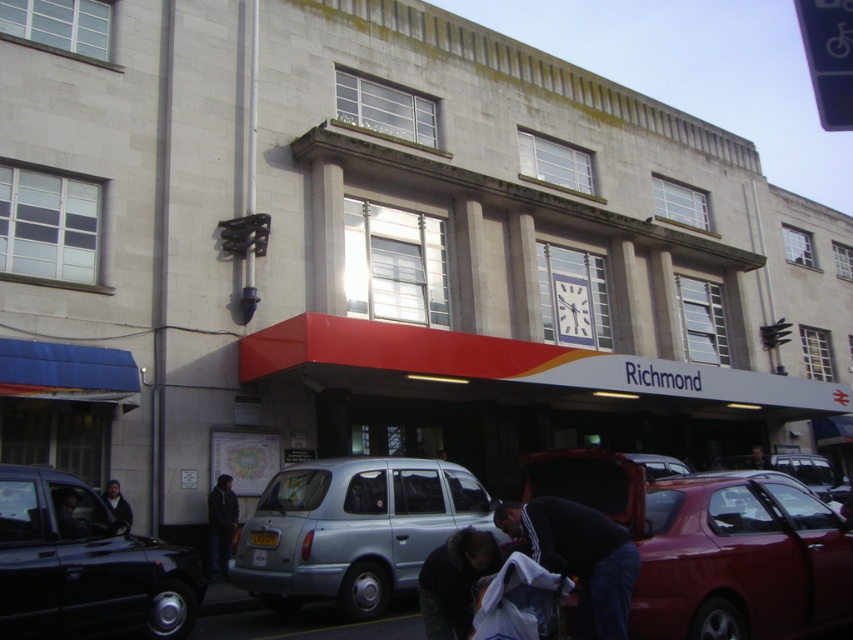
You are a delivery person who needs to load a large package into your delivery van. The van requires a clearance of 1.8 meters. You are standing in front of the shiny red car at lower right and the light blue metallic taxi at center. Which vehicle can you safely park closer to the entrance without blocking the path for taller vehicles?

The shiny red car at lower right has a lesser height compared to the light blue metallic taxi at center. Since the van requires a clearance of 1.8 meters, the shiny red car at lower right, being shorter, can be parked closer to the entrance without blocking taller vehicles.

From the picture: You are a delivery person approaching the Richmond building and need to place a package next to the matte black car door at lower left and the dark blue jacket at center. Which object should you place the package closer to if you want it to be nearer to the entrance?

The dark blue jacket at center is closer to the entrance than the matte black car door at lower left, so place the package closer to the dark blue jacket at center.

You are a delivery person who needs to park your delivery van, which is 2 meters wide, in the parking lot near the shiny red car at lower right and dark brown fur coat at lower center. Based on their widths, can you fit your van between them?

The shiny red car at lower right is wider than the dark brown fur coat at lower center. Since the van is 2 meters wide, you need to ensure there is enough space between them. However, without knowing the exact distance between the two objects, it is impossible to determine if the van will fit. Please check the actual spacing before attempting to park.